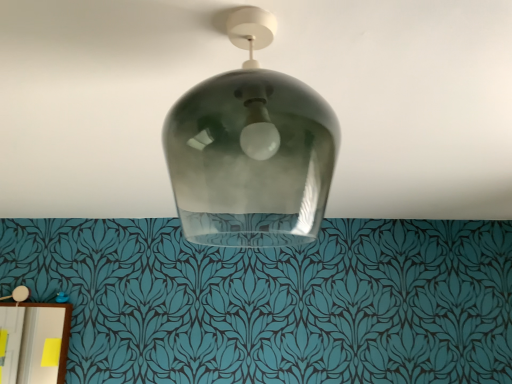
Question: Would you say transparent glass light fixture at center is to the left or to the right of smoke glass lampshade at center, the first lamp viewed from the front, in the picture?

Choices:
 (A) left
 (B) right

Answer: (B)

Question: Considering the positions of transparent glass light fixture at center and smoke glass lampshade at center, acting as the first lamp starting from the top, in the image, is transparent glass light fixture at center bigger or smaller than smoke glass lampshade at center, acting as the first lamp starting from the top,?

Choices:
 (A) big
 (B) small

Answer: (A)

Question: Which is nearer to the smoke glass lampshade at center, the first lamp viewed from the front?

Choices:
 (A) matte white lampshade at lower left, which is counted as the 2th lamp, starting from the right
 (B) transparent glass light fixture at center

Answer: (B)

Question: Estimate the real-world distances between objects in this image. Which object is closer to the transparent glass light fixture at center?

Choices:
 (A) smoke glass lampshade at center, which ranks as the 2th lamp in back-to-front order
 (B) matte white lampshade at lower left, the first lamp from the back

Answer: (A)